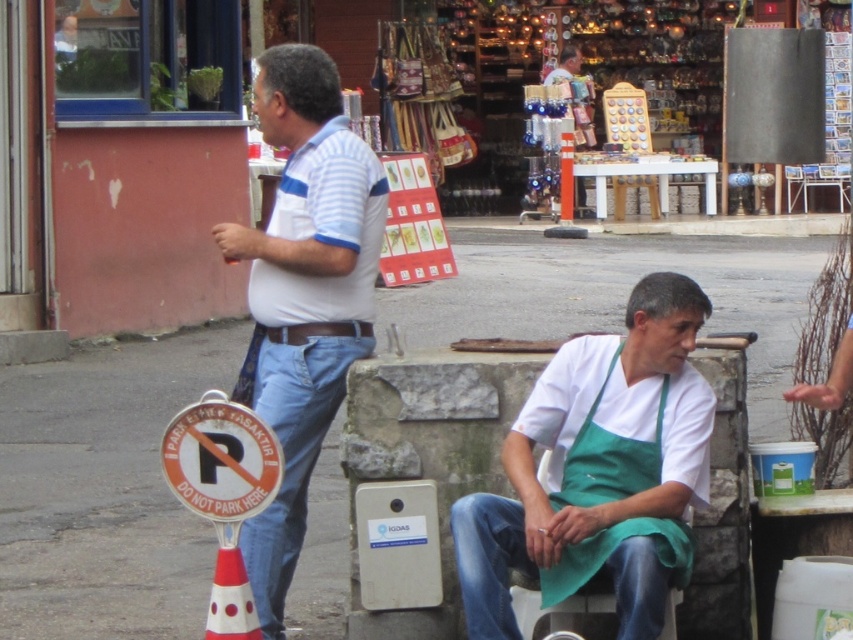
Between gray concrete pavement at center and white striped shirt at left, which one appears on the right side from the viewer's perspective?

gray concrete pavement at center is more to the right.

The height and width of the screenshot is (640, 853). Describe the element at coordinates (103, 490) in the screenshot. I see `gray concrete pavement at center` at that location.

Where is `gray concrete pavement at center`? The width and height of the screenshot is (853, 640). gray concrete pavement at center is located at coordinates (103, 490).

Which is in front, point (479, 605) or point (228, 461)?

Positioned in front is point (479, 605).

Locate an element on the screen. This screenshot has width=853, height=640. jeans at lower center is located at coordinates (489, 561).

Locate an element on the screen. This screenshot has width=853, height=640. jeans at lower center is located at coordinates (489, 561).

Between white cotton shirt at center and blue denim jeans at left, which one has more height?

white cotton shirt at center

Does white cotton shirt at center have a lesser width compared to blue denim jeans at left?

No, white cotton shirt at center is not thinner than blue denim jeans at left.

Where is `white cotton shirt at center`? This screenshot has height=640, width=853. white cotton shirt at center is located at coordinates pyautogui.click(x=599, y=472).

At what (x,y) coordinates should I click in order to perform the action: click on white cotton shirt at center. Please return your answer as a coordinate pair (x, y). Image resolution: width=853 pixels, height=640 pixels. Looking at the image, I should click on (599, 472).